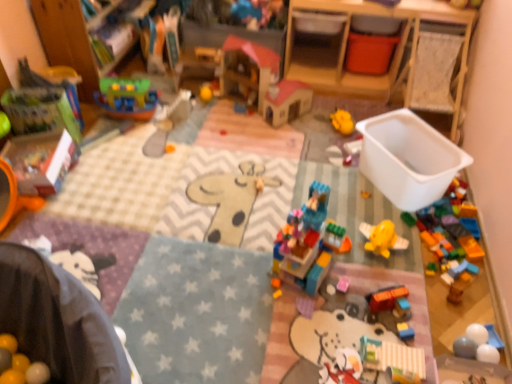
Find the location of a particular element. The height and width of the screenshot is (384, 512). free spot in front of translucent plastic boat at upper left, the 4th toy viewed from the top is located at coordinates (115, 140).